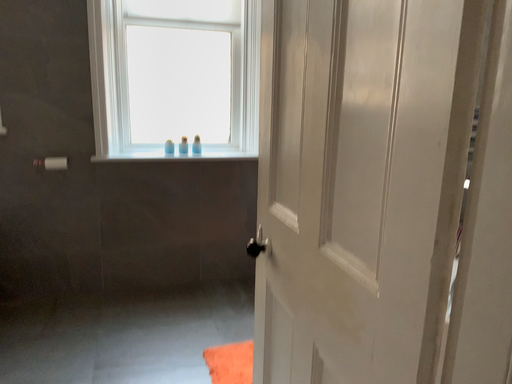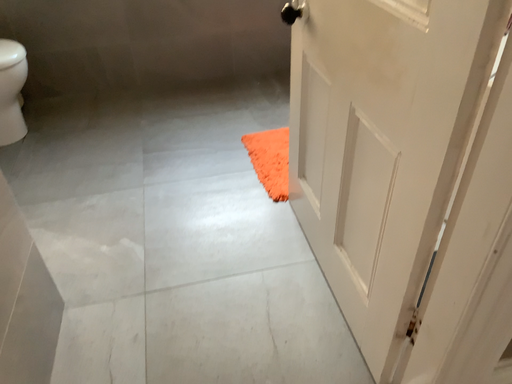
Question: How did the camera likely rotate when shooting the video?

Choices:
 (A) rotated downward
 (B) rotated upward

Answer: (A)